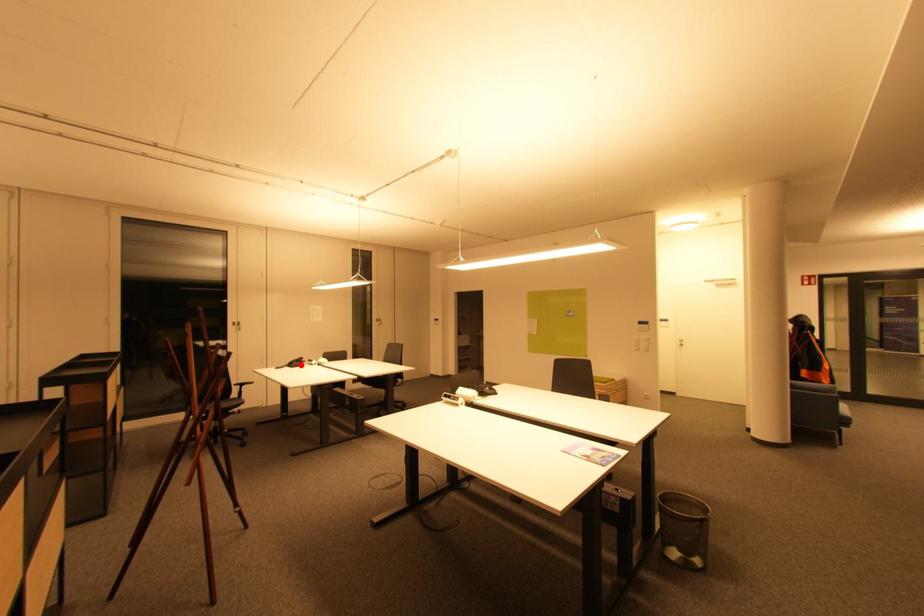
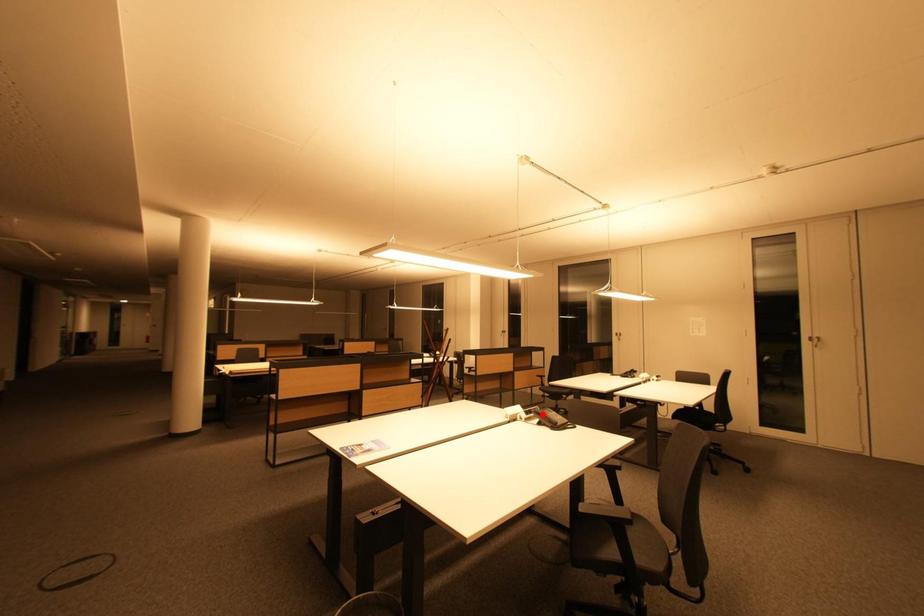
I am providing you with two images of the same scene from different viewpoints. A red point is marked on the first image and another point is marked on the second image. Are the points marked in image1 and image2 representing the same 3D position?

No